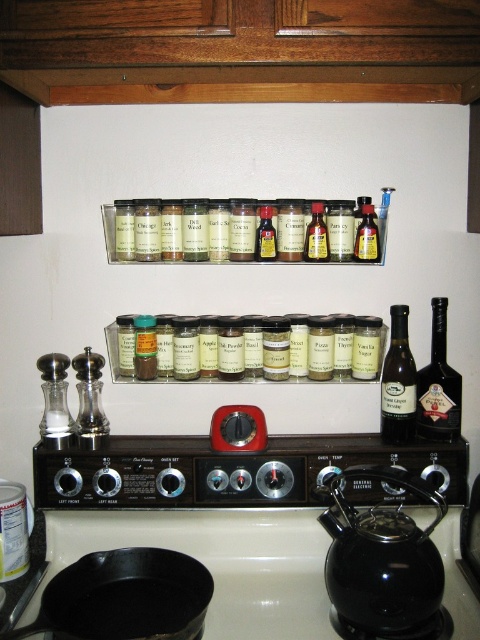
Is point (444, 381) positioned before point (407, 412)?

No, it is not.

The image size is (480, 640). Describe the element at coordinates (439, 385) in the screenshot. I see `dark glass bottle at right` at that location.

Identify the location of dark glass bottle at right. Image resolution: width=480 pixels, height=640 pixels. (439, 385).

Who is more distant from viewer, (412, 413) or (374, 220)?

Positioned behind is point (412, 413).

Where is `dark brown glass bottle at center-right`? The width and height of the screenshot is (480, 640). dark brown glass bottle at center-right is located at coordinates (397, 381).

Is point (410, 412) positioned in front of point (256, 216)?

No, it is not.

The height and width of the screenshot is (640, 480). Find the location of `dark brown glass bottle at center-right`. dark brown glass bottle at center-right is located at coordinates (397, 381).

Can you confirm if translucent glass spice jars at center is positioned below yellow glass bottle at center?

Yes.

Who is more forward, [109,365] or [363,253]?

Point [363,253]

At what (x,y) coordinates should I click in order to perform the action: click on translucent glass spice jars at center. Please return your answer as a coordinate pair (x, y). The width and height of the screenshot is (480, 640). Looking at the image, I should click on (118, 353).

At what (x,y) coordinates should I click in order to perform the action: click on translucent glass spice jars at center. Please return your answer as a coordinate pair (x, y). Looking at the image, I should click on (118, 353).